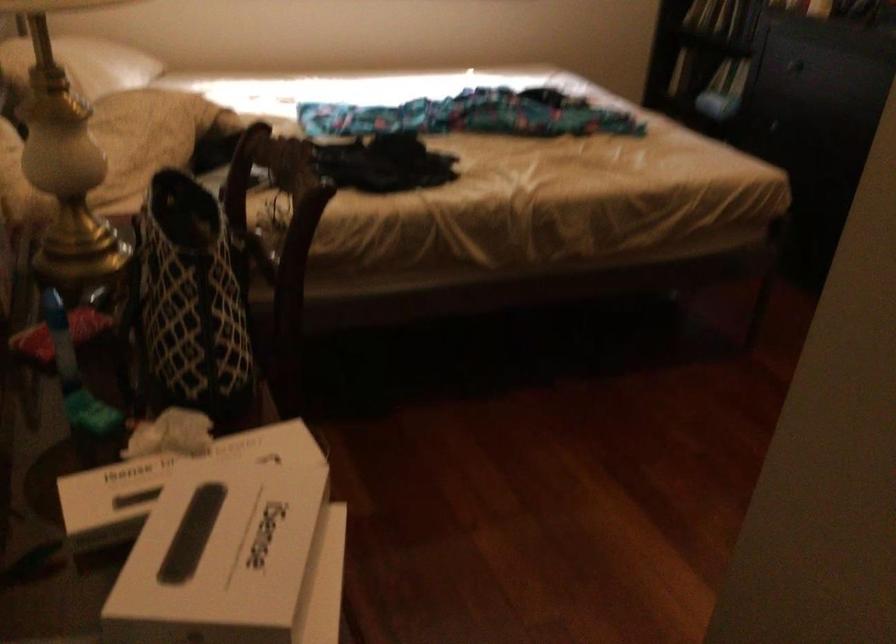
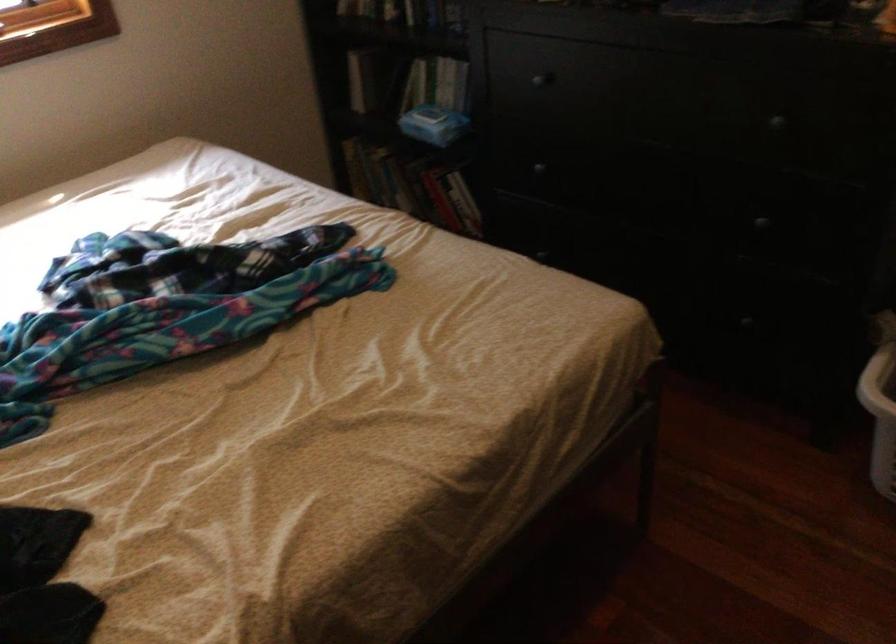
Locate, in the second image, the point that corresponds to point (731, 89) in the first image.

(433, 124)